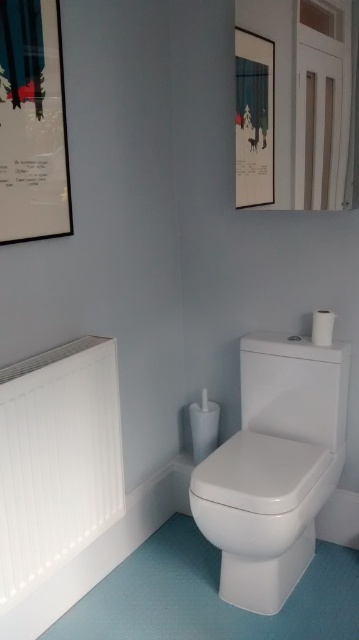
Is white glossy toilet at lower right shorter than matte black picture frame at upper center?

In fact, white glossy toilet at lower right may be taller than matte black picture frame at upper center.

Which of these two, white glossy toilet at lower right or matte black picture frame at upper center, stands shorter?

matte black picture frame at upper center

Is point (272, 481) closer to viewer compared to point (249, 48)?

That is True.

The height and width of the screenshot is (640, 359). Find the location of `white glossy toilet at lower right`. white glossy toilet at lower right is located at coordinates click(x=273, y=467).

Can you confirm if white glossy toilet at lower right is thinner than white glossy toilet lid at center?

In fact, white glossy toilet at lower right might be wider than white glossy toilet lid at center.

Is point (337, 474) positioned before point (264, 468)?

No, it is behind (264, 468).

The image size is (359, 640). What are the coordinates of `white glossy toilet at lower right` in the screenshot? It's located at (273, 467).

Does white matte radiator at left come in front of metallic silver picture frame at upper left?

Yes, white matte radiator at left is in front of metallic silver picture frame at upper left.

Between white matte radiator at left and metallic silver picture frame at upper left, which one has more height?

white matte radiator at left is taller.

Locate an element on the screen. white matte radiator at left is located at coordinates (57, 460).